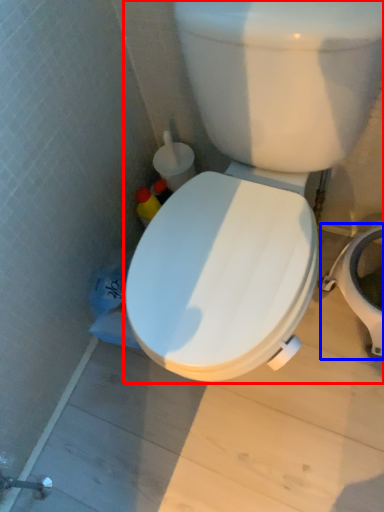
Question: Which object appears farthest to the camera in this image, toilet (highlighted by a red box) or bidet (highlighted by a blue box)?

Choices:
 (A) toilet
 (B) bidet

Answer: (B)